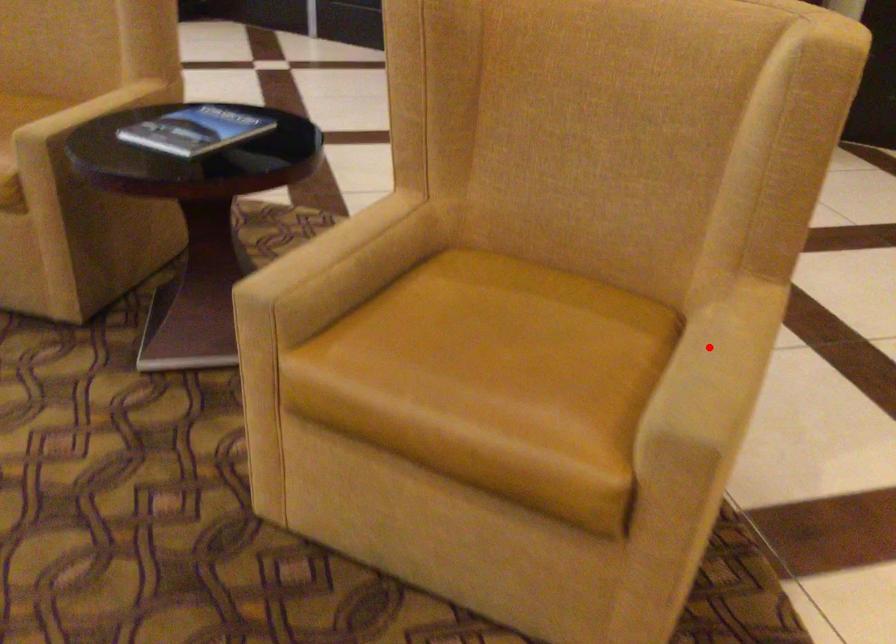
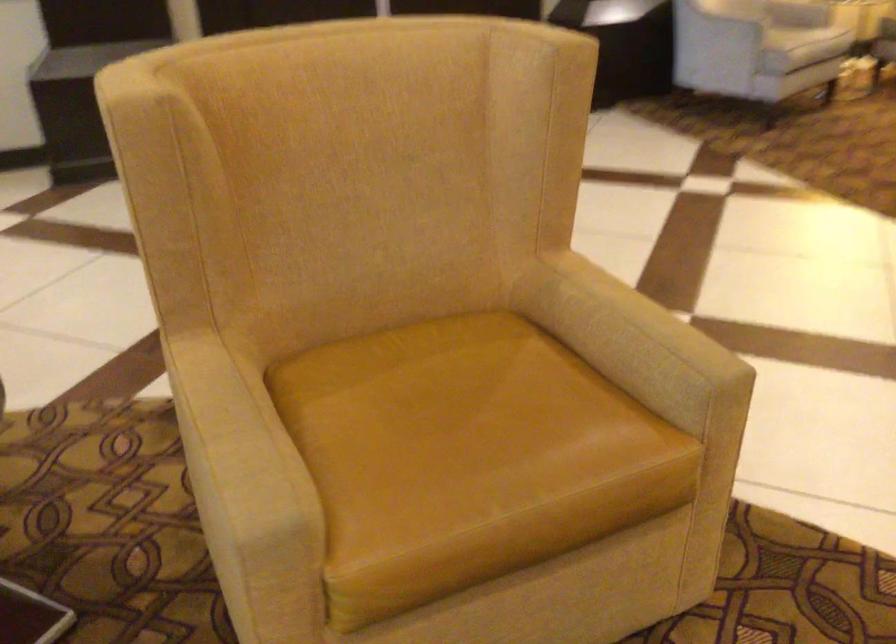
Question: I am providing you with two images of the same scene from different viewpoints. A red point is shown in image1. For the corresponding object point in image2, is it positioned nearer or farther from the camera?

Choices:
 (A) Nearer
 (B) Farther

Answer: (B)